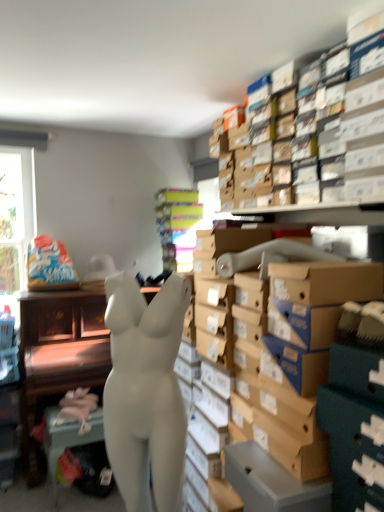
Question: Considering the relative positions of white matte mannequin at center and multicolored cardboard boxes at center in the image provided, is white matte mannequin at center to the left of multicolored cardboard boxes at center from the viewer's perspective?

Choices:
 (A) no
 (B) yes

Answer: (B)

Question: Does white matte mannequin at center appear on the right side of multicolored cardboard boxes at center?

Choices:
 (A) yes
 (B) no

Answer: (B)

Question: Is white matte mannequin at center turned away from multicolored cardboard boxes at center?

Choices:
 (A) yes
 (B) no

Answer: (B)

Question: Is white matte mannequin at center smaller than multicolored cardboard boxes at center?

Choices:
 (A) no
 (B) yes

Answer: (A)

Question: From the image's perspective, does white matte mannequin at center appear lower than multicolored cardboard boxes at center?

Choices:
 (A) yes
 (B) no

Answer: (A)

Question: Choose the correct answer: Is multicolored cardboard boxes at center inside pink fabric at lower left or outside it?

Choices:
 (A) inside
 (B) outside

Answer: (B)

Question: In terms of width, does multicolored cardboard boxes at center look wider or thinner when compared to pink fabric at lower left?

Choices:
 (A) wide
 (B) thin

Answer: (A)

Question: Is multicolored cardboard boxes at center to the left or to the right of pink fabric at lower left in the image?

Choices:
 (A) left
 (B) right

Answer: (B)

Question: Is multicolored cardboard boxes at center bigger or smaller than pink fabric at lower left?

Choices:
 (A) big
 (B) small

Answer: (A)

Question: Based on their sizes in the image, would you say white matte mannequin at center is bigger or smaller than white matte mannequin at center?

Choices:
 (A) big
 (B) small

Answer: (B)

Question: From a real-world perspective, relative to white matte mannequin at center, is white matte mannequin at center vertically above or below?

Choices:
 (A) below
 (B) above

Answer: (B)

Question: Would you say white matte mannequin at center is to the left or to the right of white matte mannequin at center in the picture?

Choices:
 (A) right
 (B) left

Answer: (A)

Question: Is white matte mannequin at center situated inside white matte mannequin at center or outside?

Choices:
 (A) outside
 (B) inside

Answer: (A)

Question: Considering the positions of multicolored cardboard boxes at center and white matte mannequin at center in the image, is multicolored cardboard boxes at center wider or thinner than white matte mannequin at center?

Choices:
 (A) thin
 (B) wide

Answer: (A)

Question: Considering the positions of point (175, 206) and point (41, 359), is point (175, 206) closer or farther from the camera than point (41, 359)?

Choices:
 (A) closer
 (B) farther

Answer: (B)